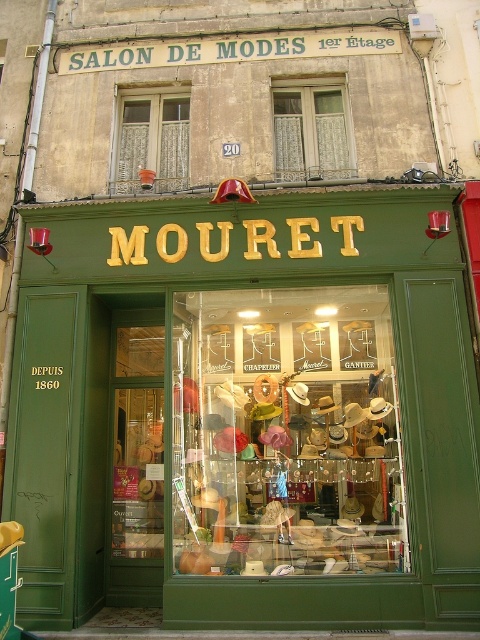
From the picture: You are standing on the street in front of the Salon de Modes Mouret. You notice the green matte storefront at center and the white lace curtains at upper center. From your perspective, which object is positioned to the right side?

The green matte storefront at center is positioned to the right of the white lace curtains at upper center.